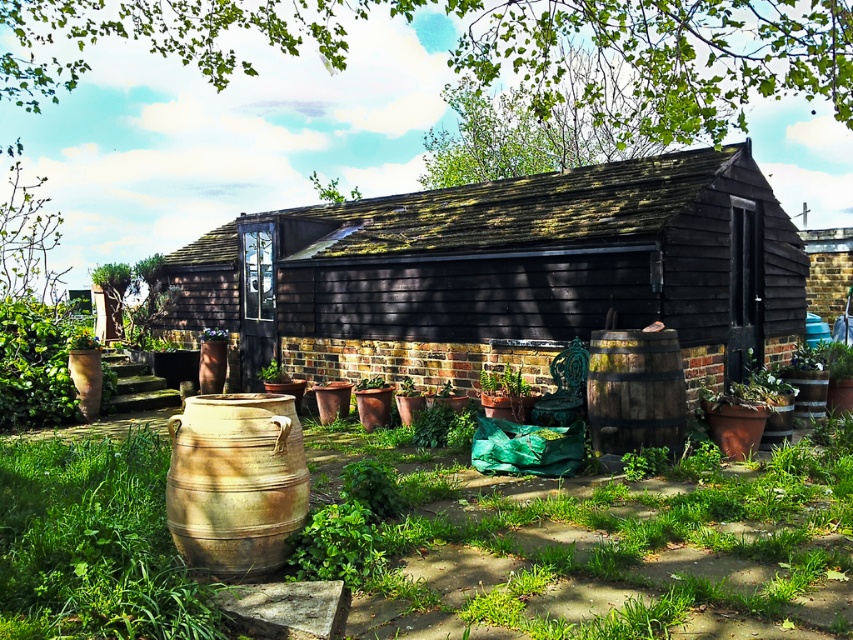
Question: Is earthy clay barrel at center to the right of brown wooden barrel at center-right from the viewer's perspective?

Choices:
 (A) no
 (B) yes

Answer: (A)

Question: Which of the following is the farthest from the observer?

Choices:
 (A) green matte plant at center
 (B) black wooden hut at center

Answer: (A)

Question: Which of the following is the farthest from the observer?

Choices:
 (A) (596, 408)
 (B) (497, 236)
 (C) (277, 371)
 (D) (222, 396)

Answer: (C)

Question: Does black wooden hut at center have a larger size compared to earthy clay barrel at center?

Choices:
 (A) yes
 (B) no

Answer: (A)

Question: Which point appears closest to the camera in this image?

Choices:
 (A) (521, 342)
 (B) (257, 509)

Answer: (B)

Question: Does brown wooden barrel at center-right have a lesser width compared to green matte plant at center?

Choices:
 (A) no
 (B) yes

Answer: (A)